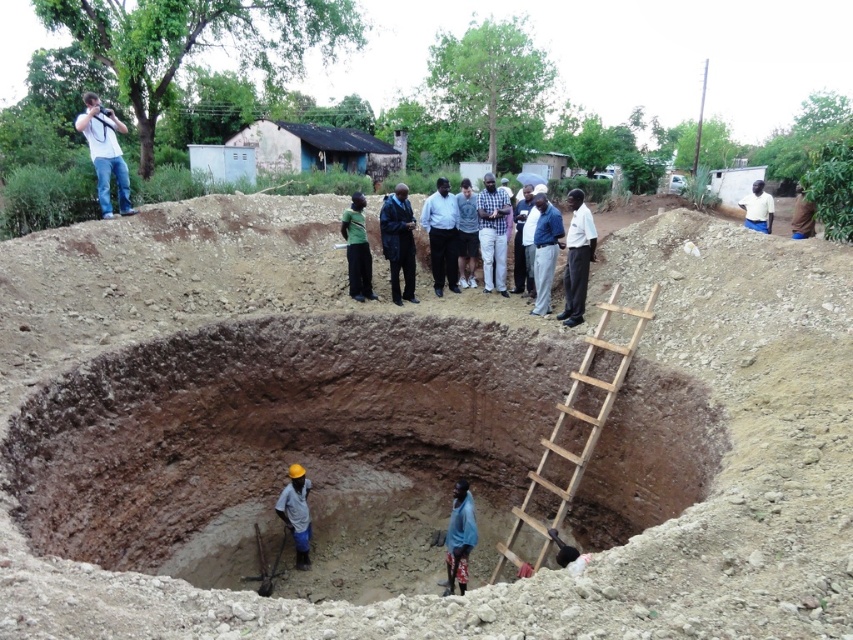
You are a safety inspector at the construction site. You need to ensure that the hard hat is placed within the designated safety zone, which is marked around the brown clay pit at center. Is the light brown hard hat at lower center positioned within the safety zone?

The brown clay pit at center is larger in size than the light brown hard hat at lower center. Since the safety zone is marked around the pit, the hat must be placed within the pit area. However, the hat is at the lower center, which is part of the pit area, so it is within the safety zone.